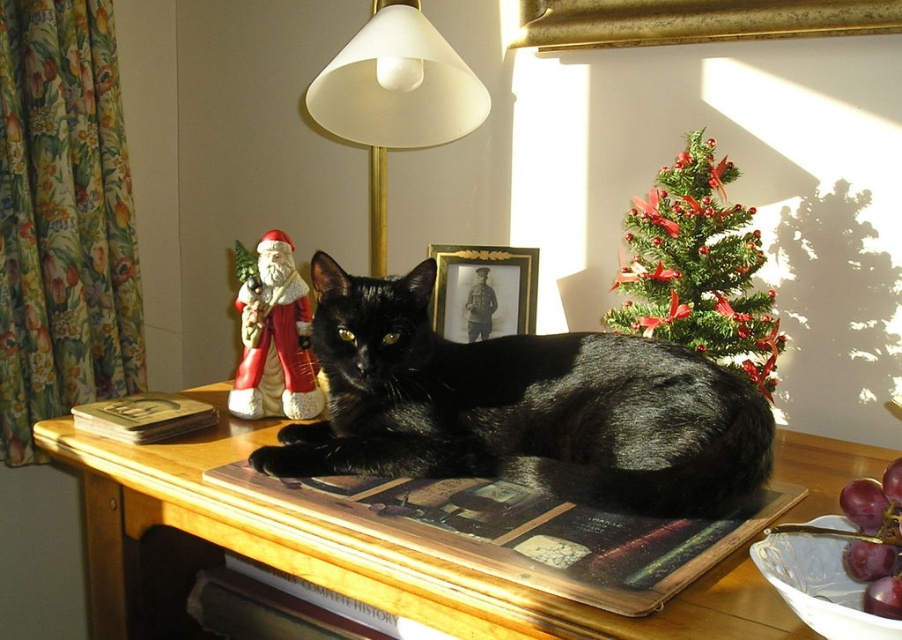
You are planning to place a new small potted plant between the green textured christmas tree at upper right and the gold metallic picture frame at center. Which object should the plant be closer to if you want it to be closer to the taller object?

The green textured christmas tree at upper right is much taller than the gold metallic picture frame at center, so the plant should be placed closer to the green textured christmas tree at upper right to be near the taller object.

You are a photographer wanting to capture the shiny black cat at center and the green textured christmas tree at upper right in the same frame. Given the height difference between them, which object would you need to adjust the camera angle to focus on first?

The shiny black cat at center is shorter than the green textured christmas tree at upper right, so you would need to adjust the camera angle to focus on the shiny black cat at center first by lowering the camera slightly to include both in the frame.

You are organizing a Christmas party and need to place a gift box between the green textured christmas tree at upper right and the gold metallic picture frame at center. Based on their positions, where should you place the gift box?

The green textured christmas tree at upper right is located above the gold metallic picture frame at center, so you should place the gift box between them in the space below the tree and above the frame.